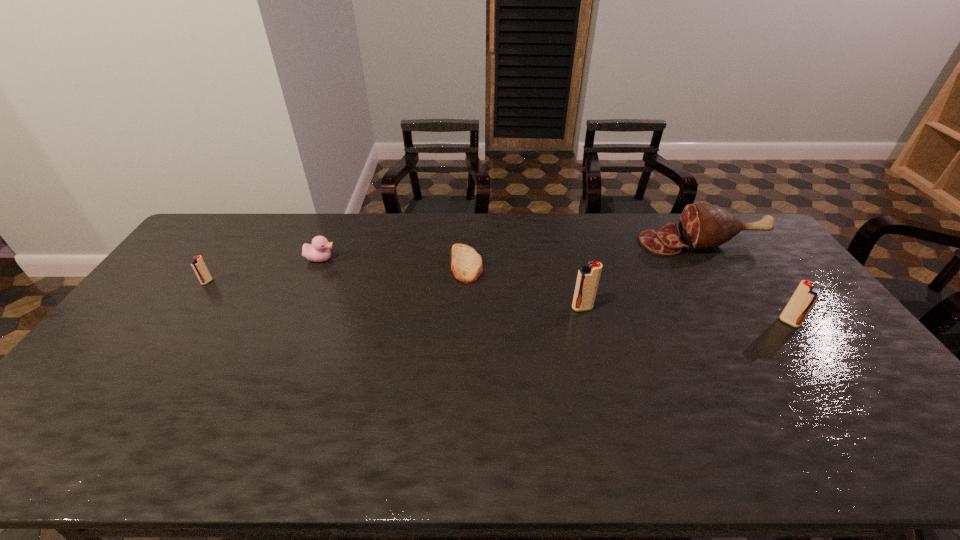
This screenshot has width=960, height=540. I want to click on the farthest igniter, so click(x=198, y=265).

The image size is (960, 540). I want to click on the shortest igniter, so click(x=198, y=265).

The width and height of the screenshot is (960, 540). Find the location of `the second igniter from left to right`. the second igniter from left to right is located at coordinates (588, 277).

What are the coordinates of `the second nearest igniter` in the screenshot? It's located at (588, 277).

You are a GUI agent. You are given a task and a screenshot of the screen. Output one action in this format:
    pyautogui.click(x=<x>, y=<y>)
    Task: Click on the nearest object
    This screenshot has height=540, width=960.
    Given the screenshot: What is the action you would take?
    pyautogui.click(x=805, y=296)

Locate an element on the screen. Image resolution: width=960 pixels, height=540 pixels. the rightmost igniter is located at coordinates (805, 296).

This screenshot has height=540, width=960. In order to click on ham in this screenshot , I will do `click(702, 226)`.

Where is `duckling`? This screenshot has height=540, width=960. duckling is located at coordinates (318, 251).

Find the location of a particular element. the fourth object from right to left is located at coordinates (466, 264).

Where is `pita bread`? Image resolution: width=960 pixels, height=540 pixels. pita bread is located at coordinates (466, 264).